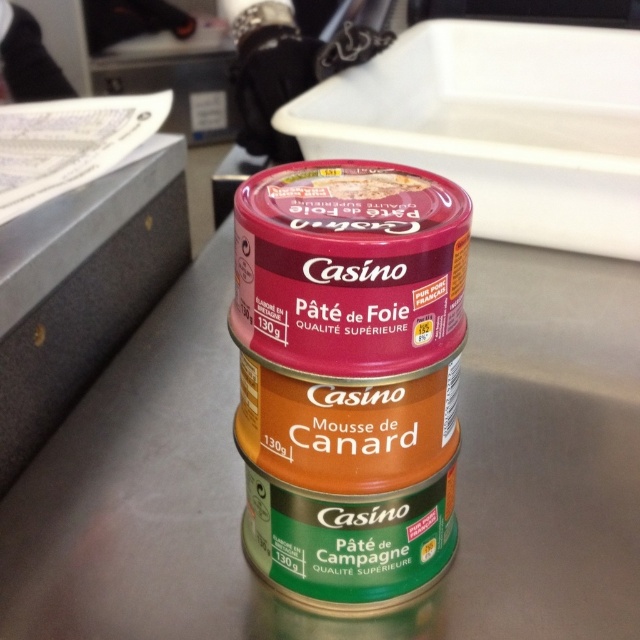
Question: Can you confirm if green matte can at center is positioned above matte plastic pâté at center?

Choices:
 (A) no
 (B) yes

Answer: (A)

Question: Is green matte can at center positioned at the back of matte plastic pâté at center?

Choices:
 (A) no
 (B) yes

Answer: (A)

Question: Which of the following is the farthest from the observer?

Choices:
 (A) (307, 189)
 (B) (384, 324)

Answer: (A)

Question: Which of the following is the farthest from the observer?

Choices:
 (A) green matte can at center
 (B) matte plastic pâté at center

Answer: (B)

Question: Is the position of green matte can at center more distant than that of matte plastic pâté at center?

Choices:
 (A) no
 (B) yes

Answer: (A)